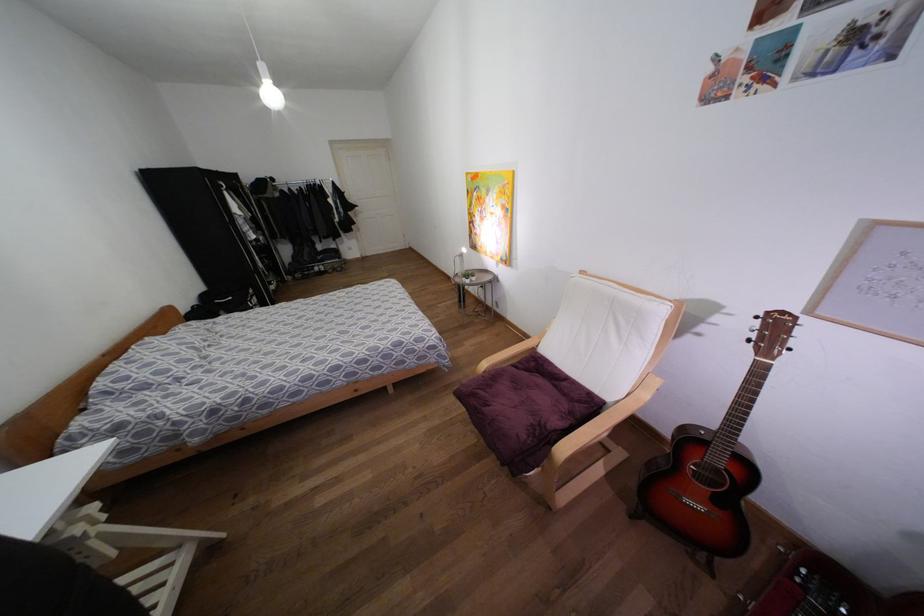
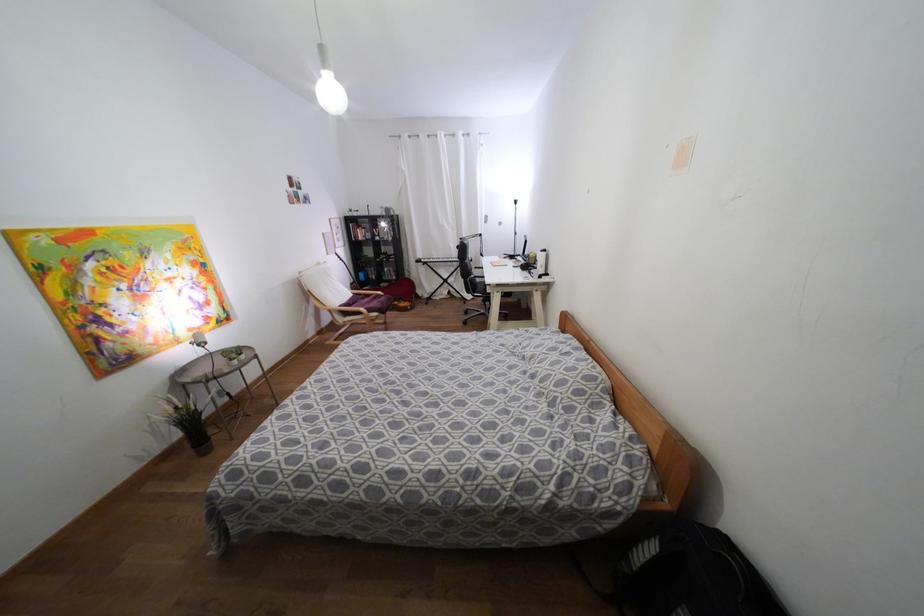
The point at (490, 254) is marked in the first image. Where is the corresponding point in the second image?

(190, 333)